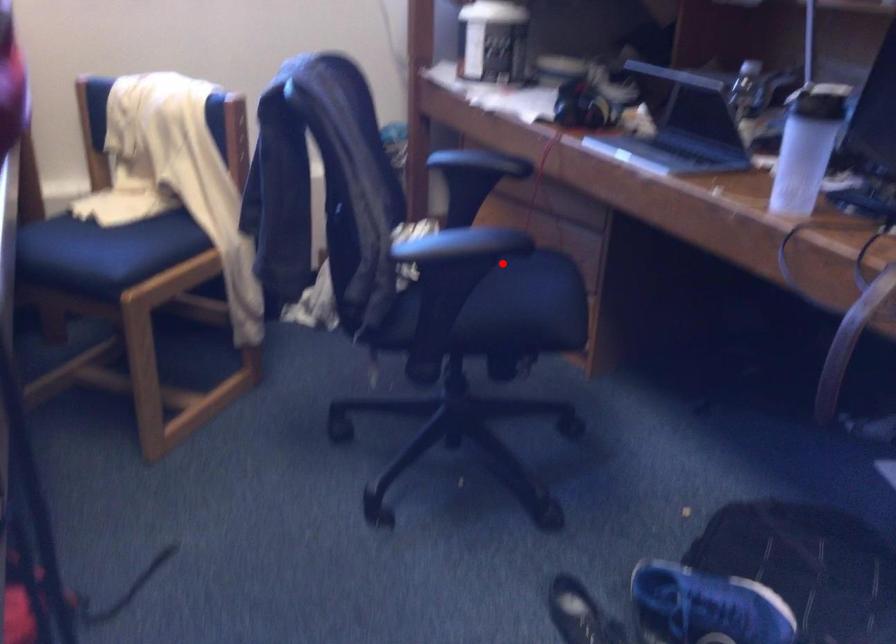
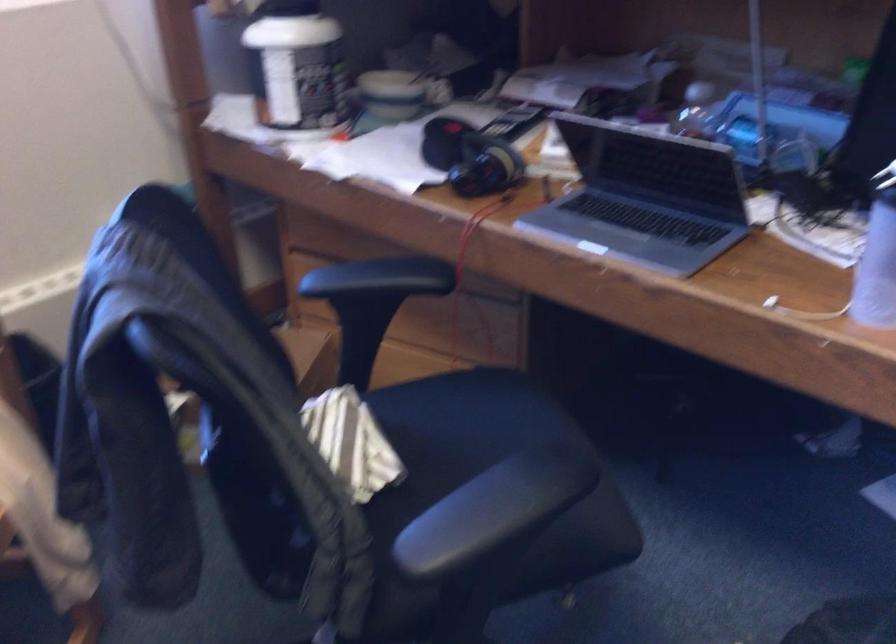
Question: I am providing you with two images of the same scene from different viewpoints. Given a red point in image1, look at the same physical point in image2. Is it:

Choices:
 (A) Closer to the viewpoint
 (B) Farther from the viewpoint

Answer: (A)